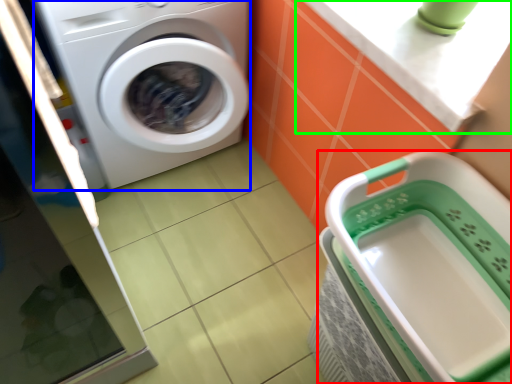
Question: Which object is the farthest from dish washer (highlighted by a red box)? Choose among these: washing machine (highlighted by a blue box) or counter top (highlighted by a green box).

Choices:
 (A) washing machine
 (B) counter top

Answer: (A)